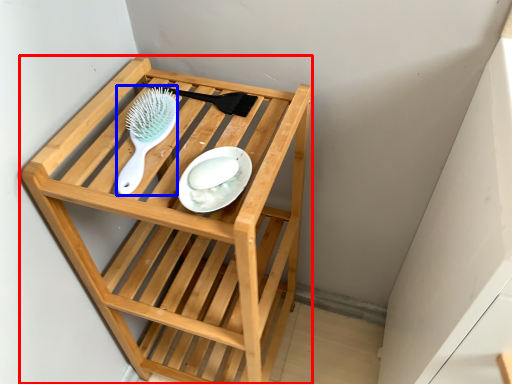
Question: Which point is closer to the camera, furniture (highlighted by a red box) or brush (highlighted by a blue box)?

Choices:
 (A) furniture
 (B) brush

Answer: (A)